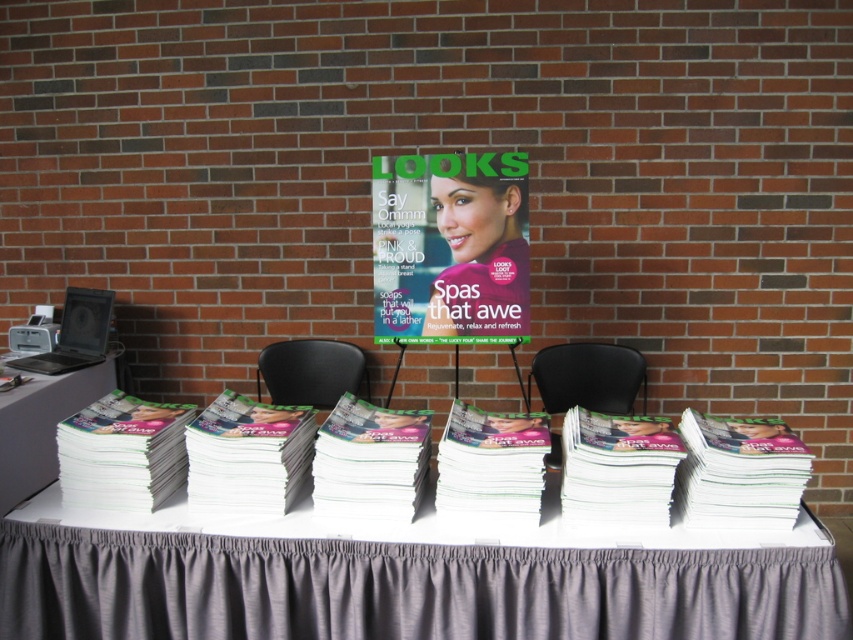
In the scene shown: You are standing in front of the table with the gray tablecloth and need to move an object from one point to another. If you have to move an object from point [837,586] to point [317,378], will you have to move it forward or backward?

Since point [837,586] is closer to the viewer than point [317,378], you will have to move the object backward to reach the destination.

You are a person who is 5 feet tall. You want to sit at the black plastic chair at center and reach the white plastic table at left to pick up a magazine. Can you comfortably do so without needing to stretch too far?

The distance between the white plastic table at left and the black plastic chair at center is 32.13 inches. Since the average comfortable reach distance for a person of that height is around 24 to 30 inches, stretching might be required, so it might not be comfortable.